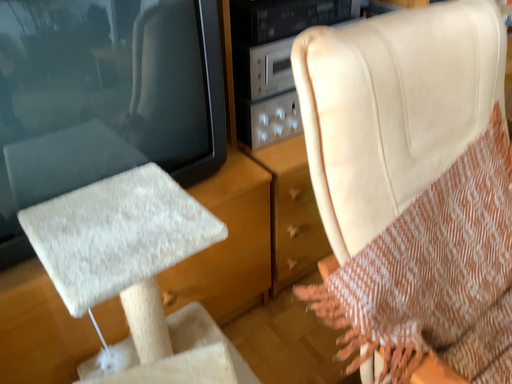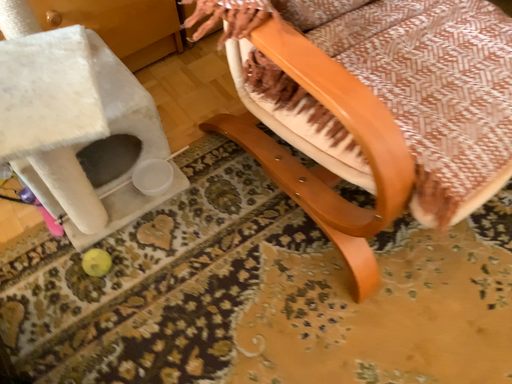
Question: Which way did the camera rotate in the video?

Choices:
 (A) rotated downward
 (B) rotated upward

Answer: (A)